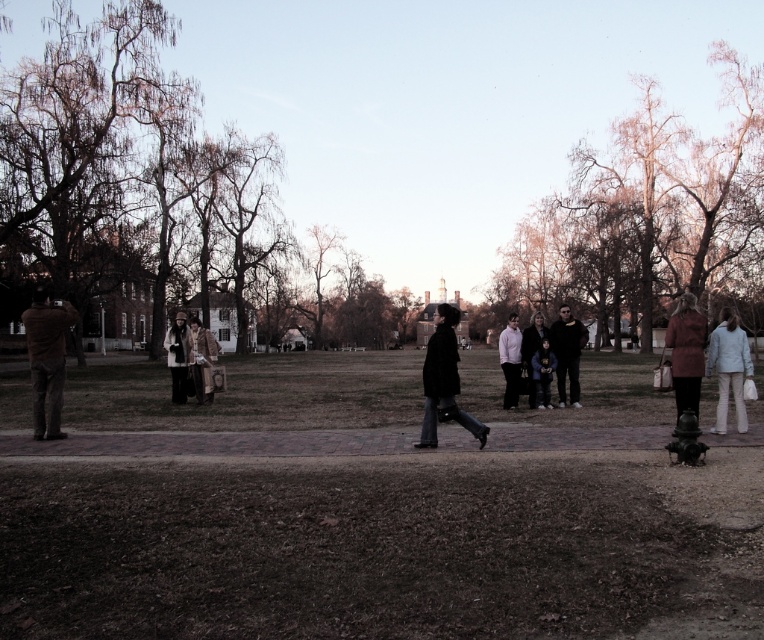
You are standing at the camera position and want to hand a light blue fabric coat at right to someone across the park. If you throw it with a maximum range of 10 meters, will it reach the coat?

The light blue fabric coat at right is 9.74 meters away from the camera. Since your maximum throwing range is 10 meters, you can successfully throw the coat to reach that distance.